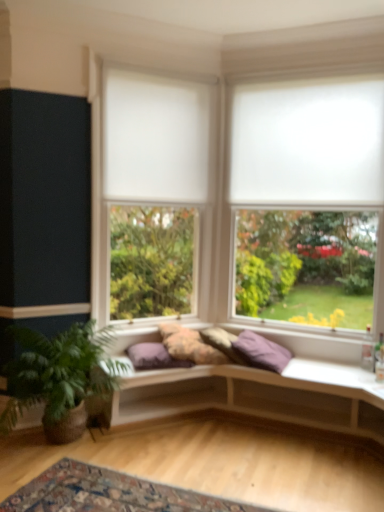
Question: Considering their positions, is fluffy fabric pillow at center, marked as the first pillow in a left-to-right arrangement, located in front of or behind purple fabric pillow at center, arranged as the 3th pillow when viewed from the left?

Choices:
 (A) front
 (B) behind

Answer: (B)

Question: Visually, is fluffy fabric pillow at center, which is the third pillow in right-to-left order, positioned to the left or to the right of purple fabric pillow at center, arranged as the 3th pillow when viewed from the left?

Choices:
 (A) right
 (B) left

Answer: (B)

Question: Based on their relative distances, which object is nearer to the carpeted rug at lower center?

Choices:
 (A) green leafy plant at lower left
 (B) purple fabric pillow at center, arranged as the 3th pillow when viewed from the left
 (C) wooden studio couch at center
 (D) white matte window at upper right, marked as the second window in a left-to-right arrangement
 (E) fluffy fabric pillow at center, which is the third pillow in right-to-left order

Answer: (A)

Question: Based on their relative distances, which object is nearer to the white matte window at center, the 1th window from the left?

Choices:
 (A) purple fabric pillow at center, which appears as the second pillow when viewed from the right
 (B) fluffy fabric pillow at center, which is the third pillow in right-to-left order
 (C) white matte curtain at upper center
 (D) white matte window at upper right, marked as the second window in a left-to-right arrangement
 (E) purple fabric pillow at center, which is the first pillow from right to left

Answer: (C)